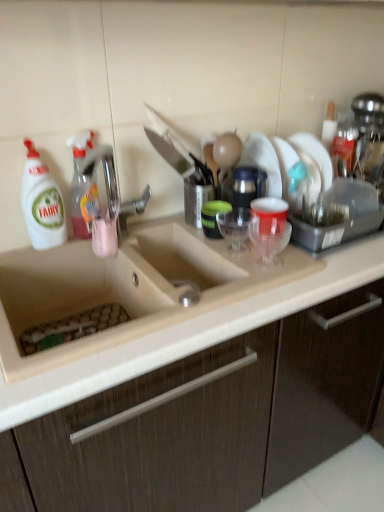
Where is `vacant space situated on the left part of transparent plastic cup at center, placed as the first tableware when sorted from right to left`? The width and height of the screenshot is (384, 512). vacant space situated on the left part of transparent plastic cup at center, placed as the first tableware when sorted from right to left is located at coordinates (221, 261).